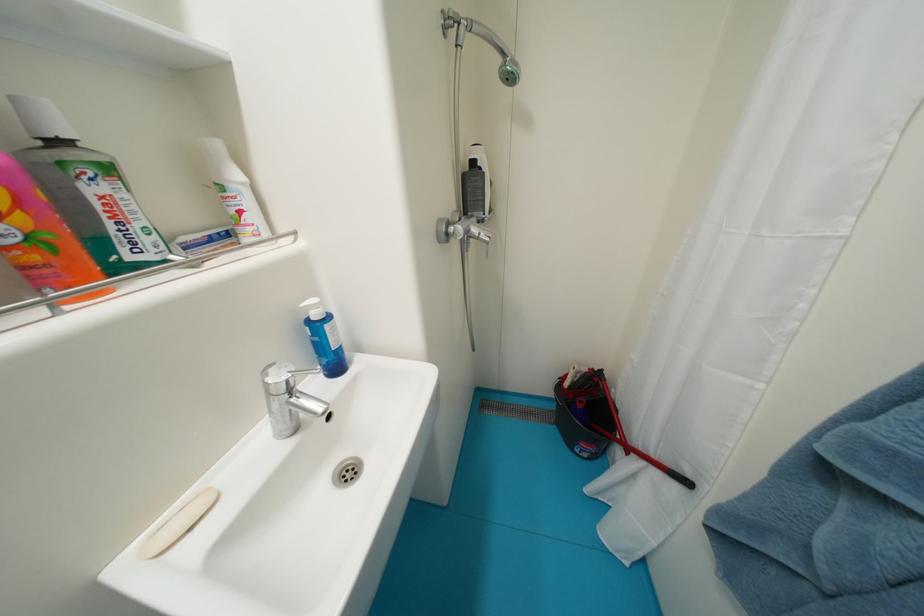
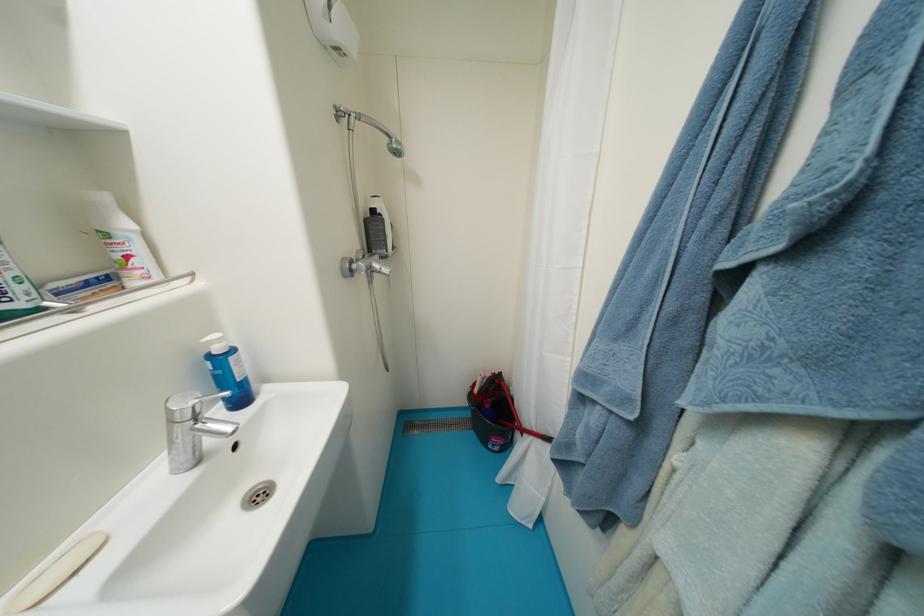
Find the pixel in the second image that matches the point at 480,164 in the first image.

(380, 214)